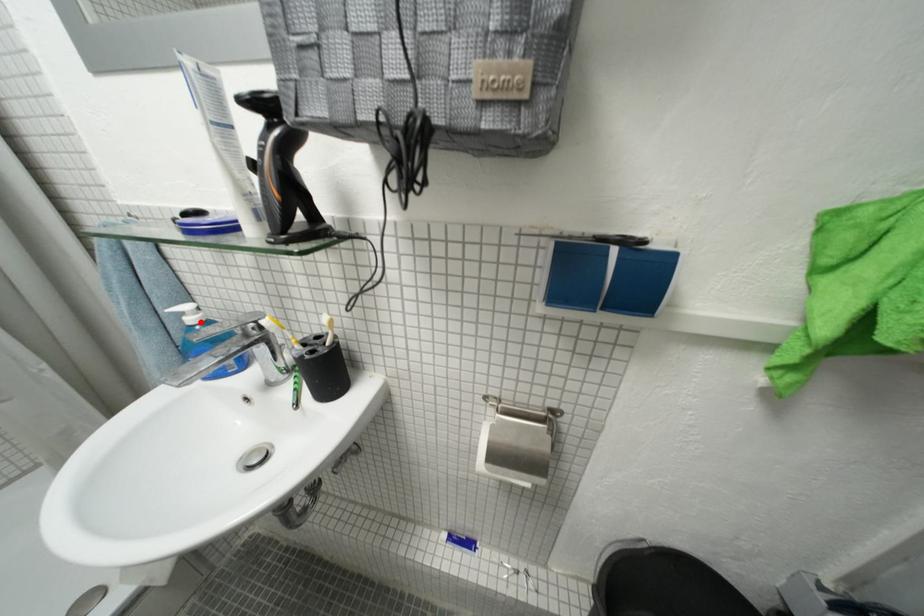
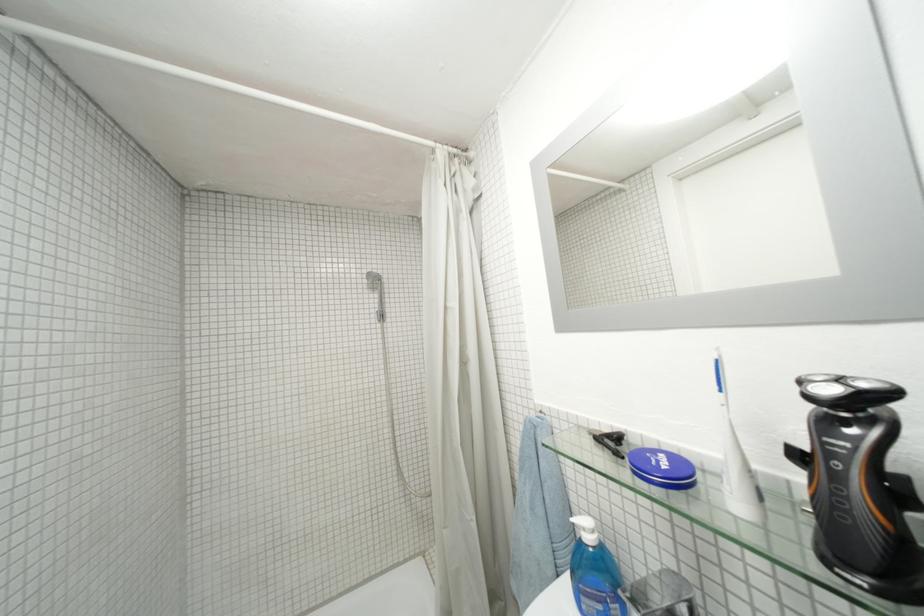
Question: I am providing you with two images of the same scene from different viewpoints. A red point is marked on the first image. At the location where the point appears in image 1, is it still visible in image 2?

Choices:
 (A) Yes
 (B) No

Answer: (A)